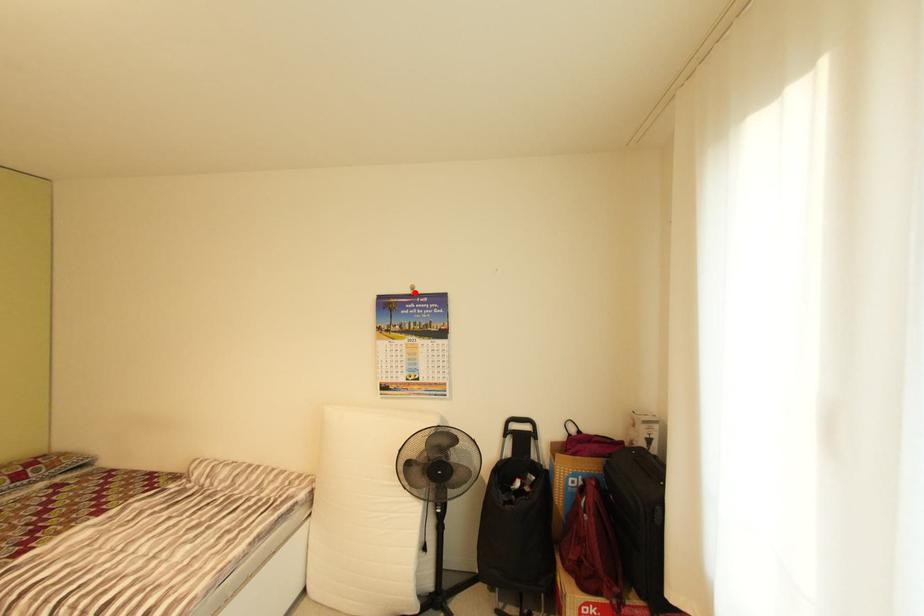
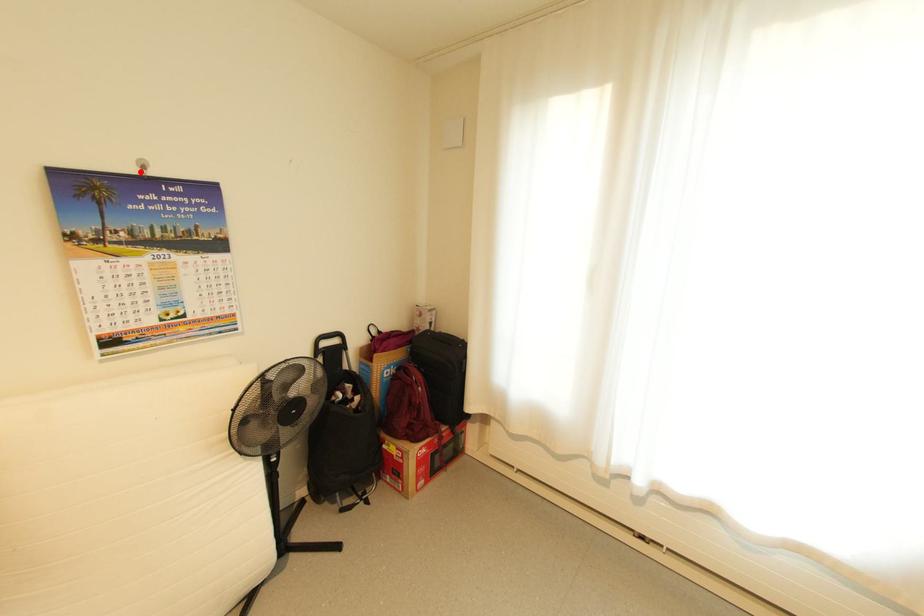
I am providing you with two images of the same scene from different viewpoints. A red point is marked on the first image and another point is marked on the second image. Are the points marked in image1 and image2 representing the same 3D position?

Yes